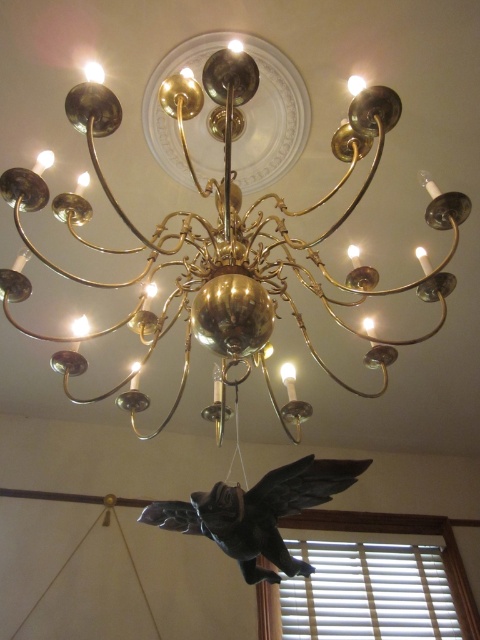
Who is taller, gold polished chandelier at center or black matte bird at center?

gold polished chandelier at center is taller.

Between point (235, 291) and point (327, 477), which one is positioned in front?

Point (235, 291) is more forward.

Is point (137, 237) less distant than point (243, 577)?

That is True.

Where is `gold polished chandelier at center`? The image size is (480, 640). gold polished chandelier at center is located at coordinates (229, 234).